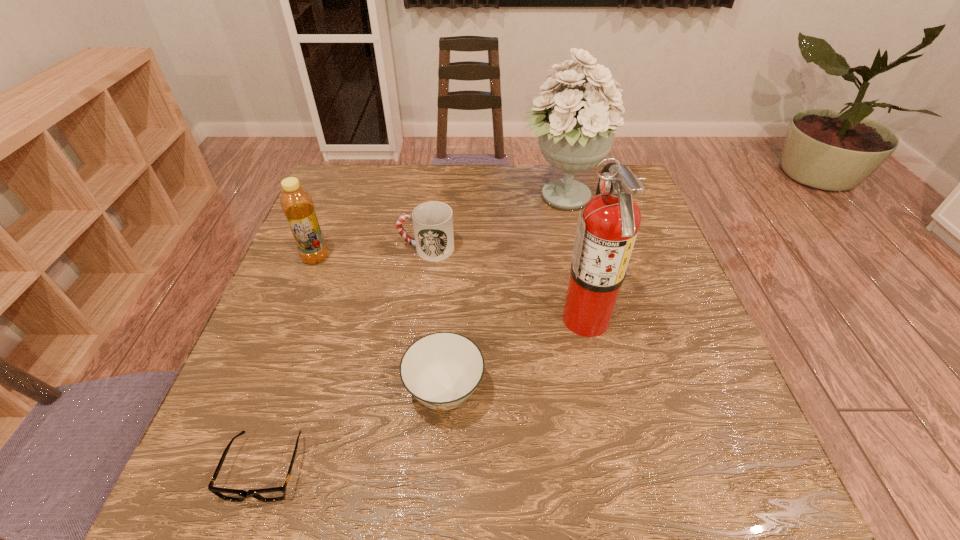
Find the location of `sunglasses located in the left edge section of the desktop`. sunglasses located in the left edge section of the desktop is located at coordinates (273, 494).

At what (x,y) coordinates should I click in order to perform the action: click on object situated at the right edge. Please return your answer as a coordinate pair (x, y). This screenshot has width=960, height=540. Looking at the image, I should click on (575, 128).

This screenshot has height=540, width=960. Find the location of `object that is at the near left corner`. object that is at the near left corner is located at coordinates (273, 494).

The height and width of the screenshot is (540, 960). In order to click on object positioned at the far right corner in this screenshot , I will do `click(575, 128)`.

At what (x,y) coordinates should I click in order to perform the action: click on vacant space at the far edge of the desktop. Please return your answer as a coordinate pair (x, y). This screenshot has height=540, width=960. Looking at the image, I should click on (505, 181).

Image resolution: width=960 pixels, height=540 pixels. Find the location of `free location at the left edge of the desktop`. free location at the left edge of the desktop is located at coordinates (314, 383).

In order to click on free point at the right edge in this screenshot , I will do `click(635, 360)`.

Locate an element on the screen. vacant space at the far left corner of the desktop is located at coordinates (365, 166).

This screenshot has width=960, height=540. In the image, there is a desktop. Identify the location of blank space at the near left corner. (221, 482).

Where is `blank space at the near right corner`? blank space at the near right corner is located at coordinates (679, 503).